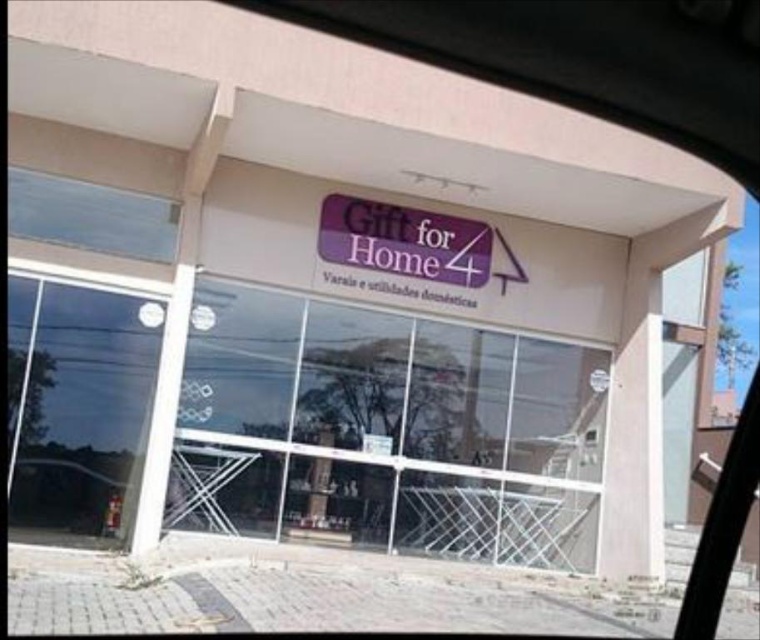
You are standing in front of the store and want to enter. Which object, the transparent glass at center or the transparent glass door at lower left, should you approach to enter the store?

You should approach the transparent glass door at lower left to enter the store because the transparent glass at center is further away from you, making the door closer and more accessible.

You are a delivery person carrying a package that is 3 meters long. You need to enter the store through either the transparent glass at center or the transparent glass door at lower left. Which entrance can you use without tilting the package?

The transparent glass at center and transparent glass door at lower left are 3.28 meters apart, so the package that is 3 meters long can fit through the space between them. Therefore, either entrance can be used without tilting the package.

Looking at this image, you are a delivery person trying to enter the store through the transparent glass at center and the transparent glass door at lower left. Which entrance has a wider opening for you to carry a large box?

The transparent glass at center has a larger width than the transparent glass door at lower left, so you should use the transparent glass at center to carry the large box through the wider opening.